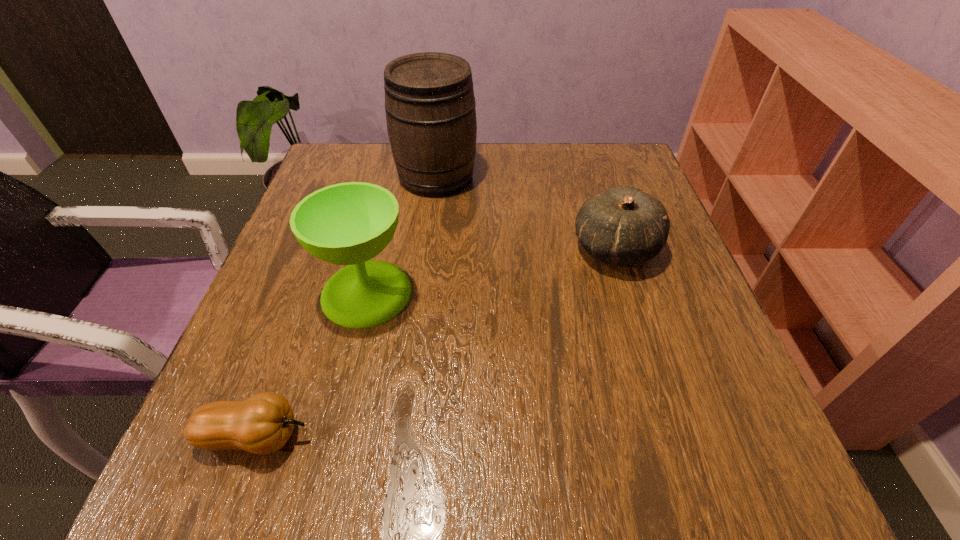
The height and width of the screenshot is (540, 960). Find the location of `free region at the right edge of the desktop`. free region at the right edge of the desktop is located at coordinates (702, 407).

Locate an element on the screen. The height and width of the screenshot is (540, 960). vacant space at the far left corner is located at coordinates (347, 160).

At what (x,y) coordinates should I click in order to perform the action: click on vacant region at the far right corner of the desktop. Please return your answer as a coordinate pair (x, y). This screenshot has height=540, width=960. Looking at the image, I should click on (636, 164).

Where is `free spot between the rightmost object and the second tallest object`? The height and width of the screenshot is (540, 960). free spot between the rightmost object and the second tallest object is located at coordinates (491, 271).

Find the location of `vacant area that lies between the wineglass and the wine bucket`. vacant area that lies between the wineglass and the wine bucket is located at coordinates (401, 234).

Where is `free space between the wine bucket and the wineglass`? free space between the wine bucket and the wineglass is located at coordinates (401, 234).

In order to click on vacant space that is in between the third shortest object and the shortest object in this screenshot , I will do `click(311, 364)`.

Where is `free area in between the shorter gourd and the taller gourd`? This screenshot has width=960, height=540. free area in between the shorter gourd and the taller gourd is located at coordinates (435, 342).

Identify the location of vacant space in between the second tallest object and the third tallest object. This screenshot has height=540, width=960. pyautogui.click(x=491, y=271).

You are a GUI agent. You are given a task and a screenshot of the screen. Output one action in this format:
    pyautogui.click(x=<x>, y=<y>)
    Task: Click on the free area in between the taller gourd and the nearer gourd
    
    Given the screenshot: What is the action you would take?
    pyautogui.click(x=435, y=342)